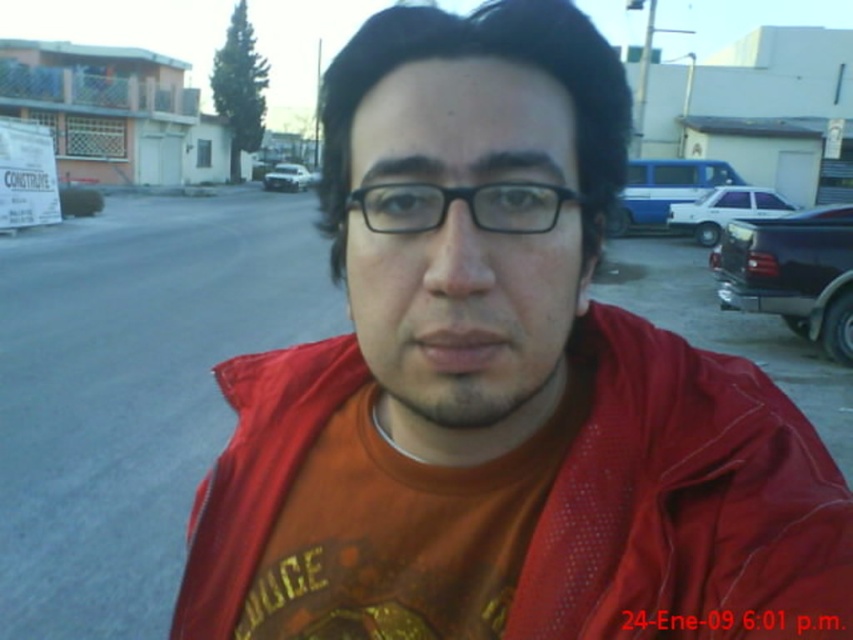
You are a photographer trying to capture a photo of the blue metallic car at upper right and the white matte car at center. Which car should you focus on if you want to include both in the frame without cropping?

You should focus on the blue metallic car at upper right because it is much taller than the white matte car at center, so it will occupy more space in the frame.

You are a delivery driver who needs to park your van between the blue metallic car at upper right and the white matte car at center. The parking space between them is 23.41 meters long. Your van is 6 meters long. Can you safely park your van in that space without needing to adjust the position?

The parking space between the blue metallic car at upper right and the white matte car at center is 23.41 meters long. Since your van is only 6 meters long, there is ample space to park without needing to adjust the position.